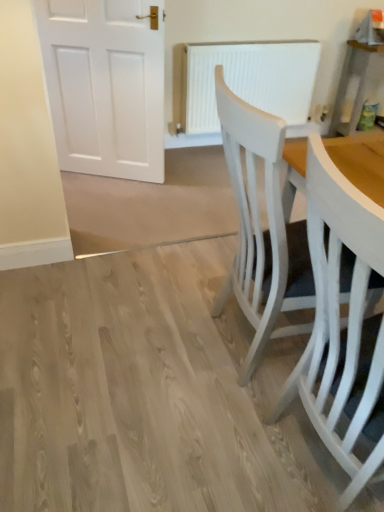
Find the location of a particular element. The image size is (384, 512). vacant space underneath white painted wood chair at right, which is the first chair in front-to-back order (from a real-world perspective) is located at coordinates (312, 468).